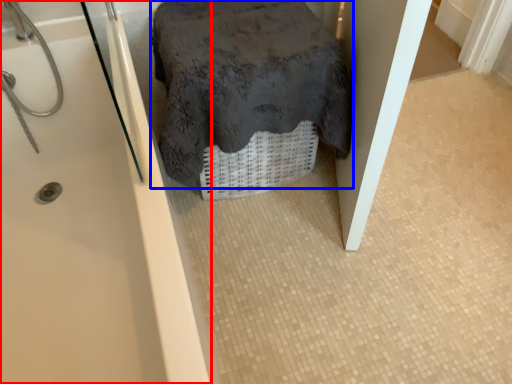
Question: Which object appears farthest to the camera in this image, bathtub (highlighted by a red box) or bath towel (highlighted by a blue box)?

Choices:
 (A) bathtub
 (B) bath towel

Answer: (B)